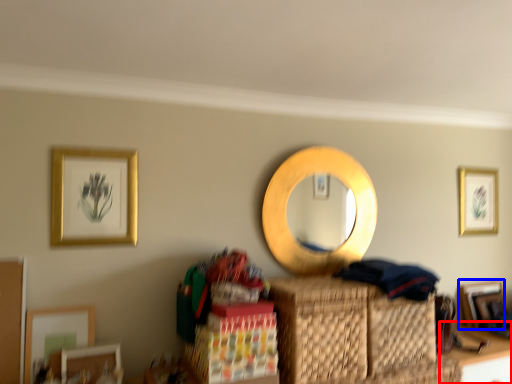
Question: Which point is further to the camera, table (highlighted by a red box) or picture frame (highlighted by a blue box)?

Choices:
 (A) table
 (B) picture frame

Answer: (B)